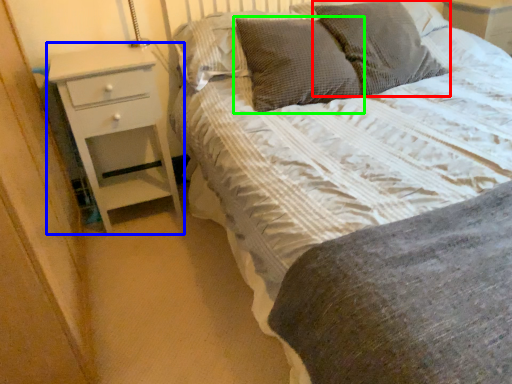
Question: Considering the real-world distances, which object is farthest from pillow (highlighted by a red box)? chest of drawers (highlighted by a blue box) or pillow (highlighted by a green box)?

Choices:
 (A) chest of drawers
 (B) pillow

Answer: (A)